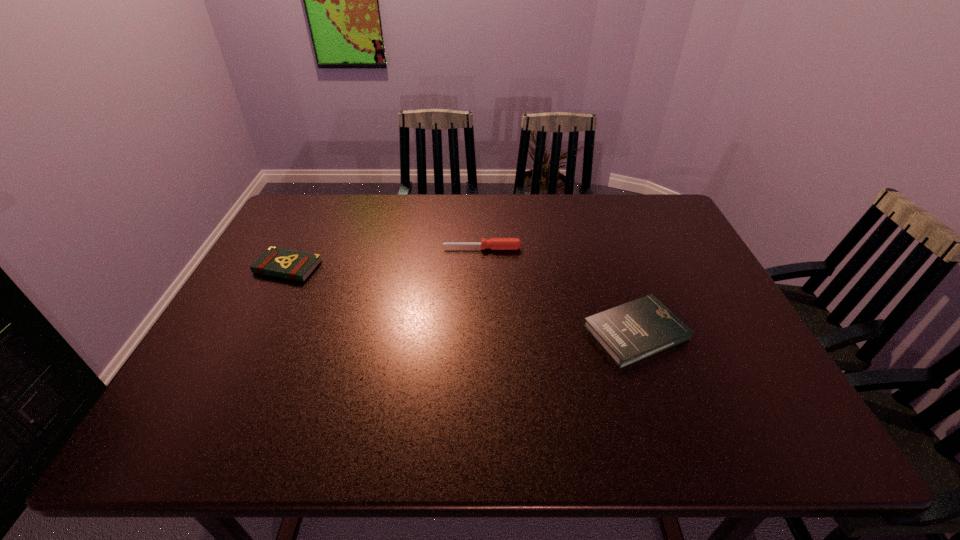
In order to click on free point between the left book and the nearest object in this screenshot , I will do `click(462, 300)`.

The height and width of the screenshot is (540, 960). I want to click on vacant area that lies between the right book and the screwdriver, so click(559, 291).

The image size is (960, 540). In order to click on empty space between the farthest object and the right book in this screenshot , I will do `click(559, 291)`.

Locate an element on the screen. The height and width of the screenshot is (540, 960). vacant area that lies between the farther book and the right book is located at coordinates (462, 300).

Image resolution: width=960 pixels, height=540 pixels. I want to click on blank region between the second farthest object and the second object from left to right, so click(x=385, y=258).

What are the coordinates of `vacant space that's between the nearest object and the second object from left to right` in the screenshot? It's located at (559, 291).

At what (x,y) coordinates should I click in order to perform the action: click on object that can be found as the second closest to the farther book. Please return your answer as a coordinate pair (x, y). The height and width of the screenshot is (540, 960). Looking at the image, I should click on (630, 332).

Find the location of a particular element. the closest object to the second object from right to left is located at coordinates (630, 332).

At what (x,y) coordinates should I click in order to perform the action: click on free point that satisfies the following two spatial constraints: 1. on the front side of the right book; 2. on the left side of the leftmost object. Please return your answer as a coordinate pair (x, y). This screenshot has height=540, width=960. Looking at the image, I should click on (254, 333).

What are the coordinates of `free spot that satisfies the following two spatial constraints: 1. on the front side of the nearer book; 2. on the left side of the screwdriver` in the screenshot? It's located at (483, 333).